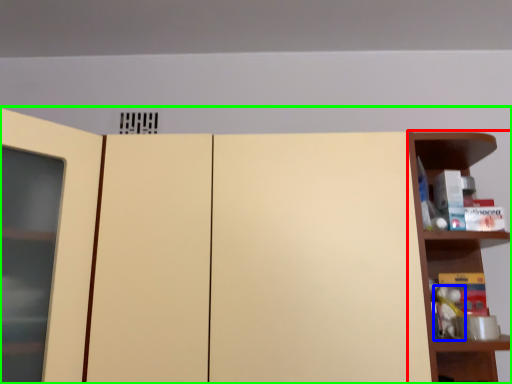
Question: Considering the real-world distances, which object is closest to shelf (highlighted by a red box)? toy (highlighted by a blue box) or cupboard (highlighted by a green box).

Choices:
 (A) toy
 (B) cupboard

Answer: (A)